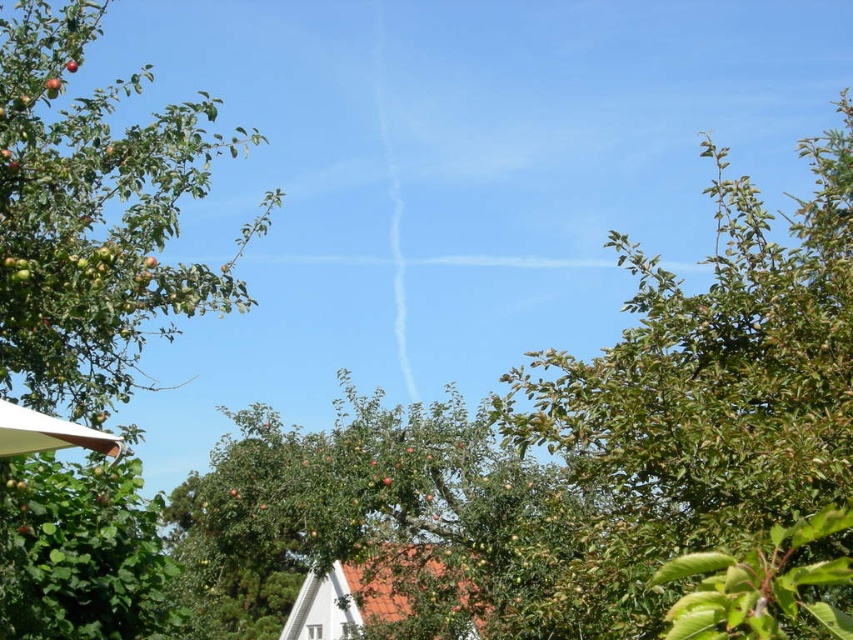
You are an apple picker standing in the orchard and see both the ripe red apple at upper left and the ripe red apple at center. Which apple is closer to you?

The ripe red apple at upper left is closer to you because it is in front of the ripe red apple at center.

You are an apple picker standing at the base of the green leafy tree at upper right and want to reach the ripe red apple at center. Considering the height difference between them, can you easily pick the apple without any tools?

The green leafy tree at upper right is much taller than the ripe red apple at center, so the apple is likely lower and within reach without needing tools.